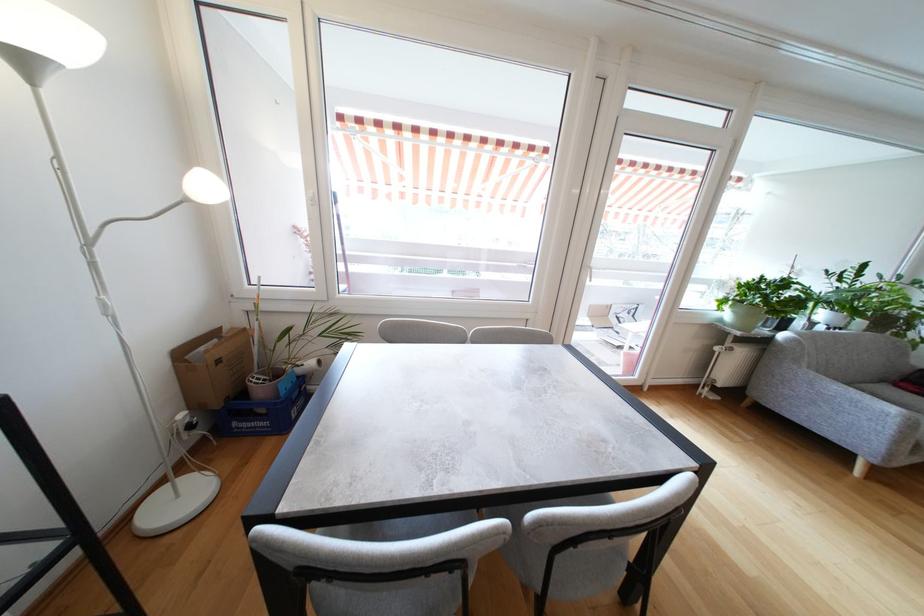
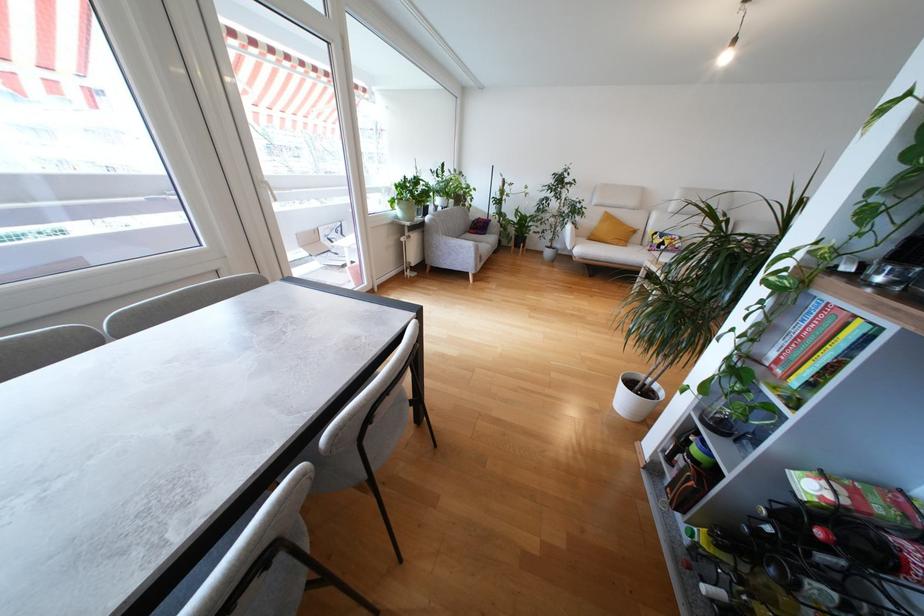
First-person continuous shooting, in which direction is the camera rotating?

The camera's rotation is toward right-down.